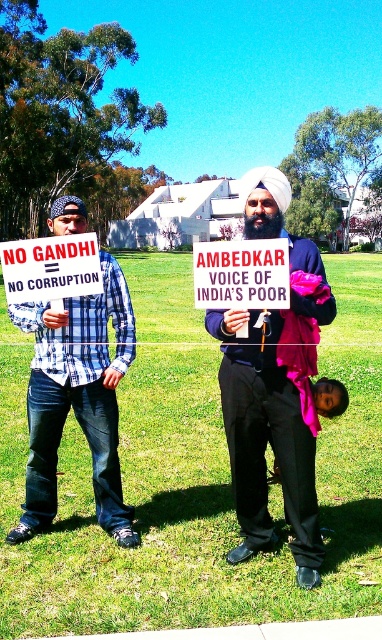
You are a photographer trying to capture both the dark blue fabric turban at center and the blue plaid shirt at left in a single shot. Based on their positions, which object should you focus on first to ensure both are in sharp focus?

You should focus on the dark blue fabric turban at center first because it is closer to the viewer than the blue plaid shirt at left, ensuring both will be in focus when using a shallow depth of field.

In the scene shown: You are a drone operator trying to capture a photo of the cardboard sign at center. The drone is currently at point A, which is at coordinates 0.400, 0.600. To ensure the sign is in the center of the photo, should you move the drone north or south? Please explain your reasoning based on the coordinates provided.

The cardboard sign at center is located at coordinates (242,275). The drone is at (229,256). Comparing the y coordinates, 0.634 is higher than 0.600. Since higher y values correspond to northward direction, moving the drone north will bring it closer to the sign. Therefore, move north to center the sign in the photo.

From the picture: You are a photographer planning to take a group photo of the two people holding the cardboard sign at center and white paper sign at center. You want to ensure both signs are clearly visible in the photo. Which sign should you focus on to ensure it appears larger in the photo?

The cardboard sign at center has a larger size compared to the white paper sign at center, so focusing on the cardboard sign at center will ensure it appears larger in the photo.